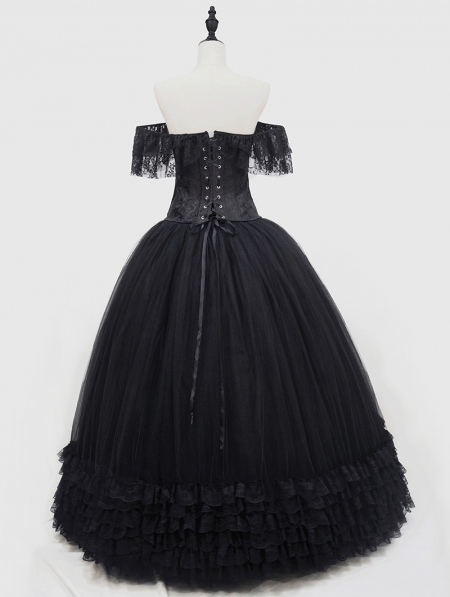
Where is `armless, headless mannequin`? armless, headless mannequin is located at coordinates (212, 99).